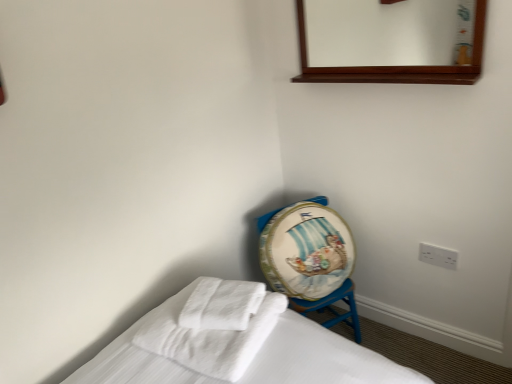
Locate an element on the screen. The height and width of the screenshot is (384, 512). vacant space situated on the left part of white soft towel at center, the 1th bath towel from the right is located at coordinates (166, 327).